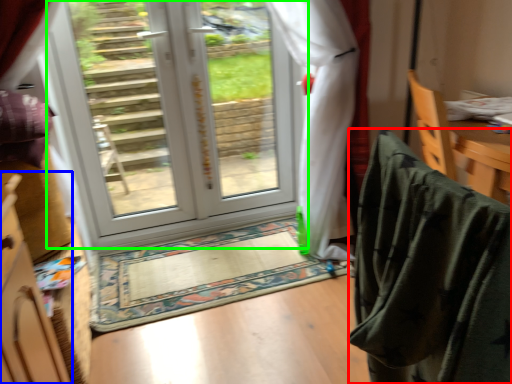
Question: Which is nearer to the blanket (highlighted by a red box)? cabinetry (highlighted by a blue box) or door (highlighted by a green box).

Choices:
 (A) cabinetry
 (B) door

Answer: (A)